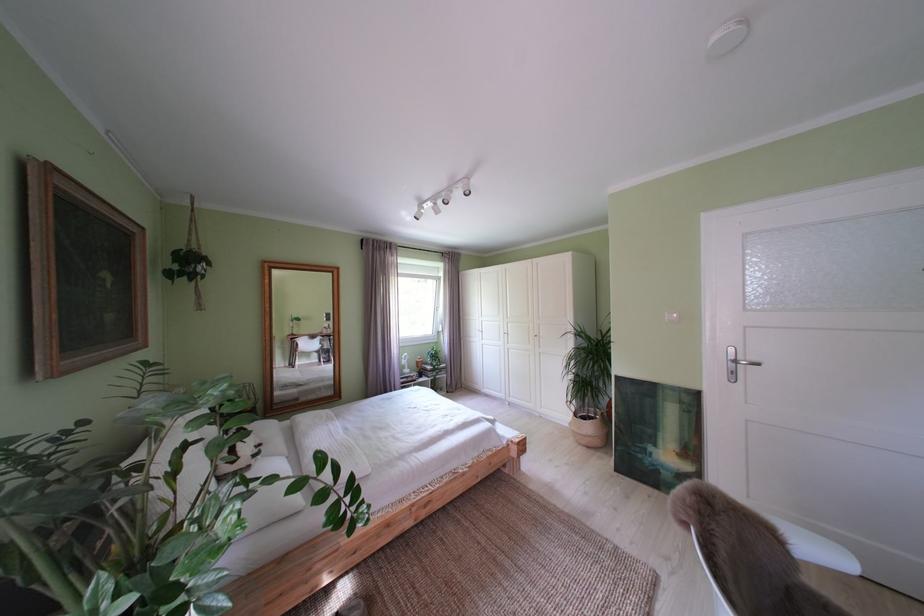
Locate an element on the screen. This screenshot has height=616, width=924. white wardrobe handle is located at coordinates (537, 334).